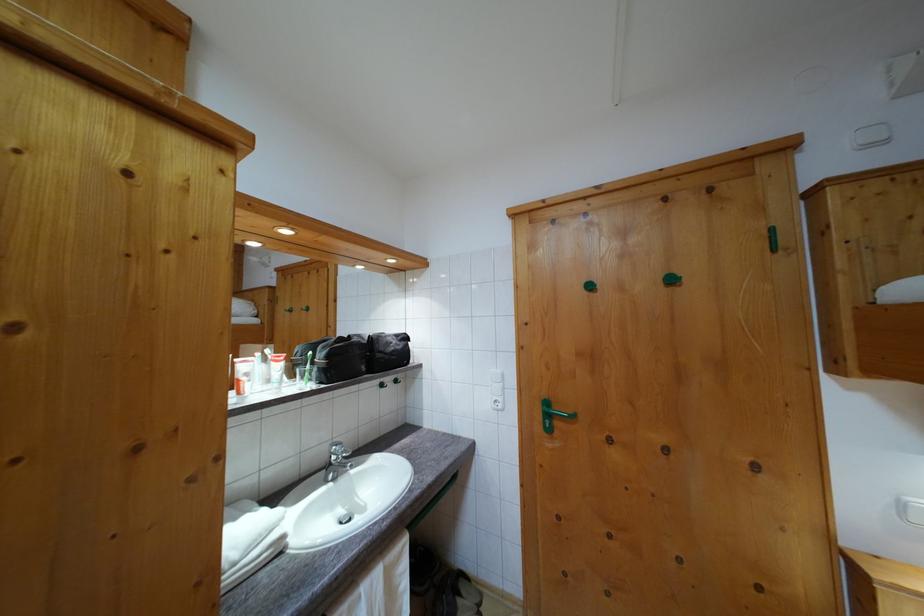
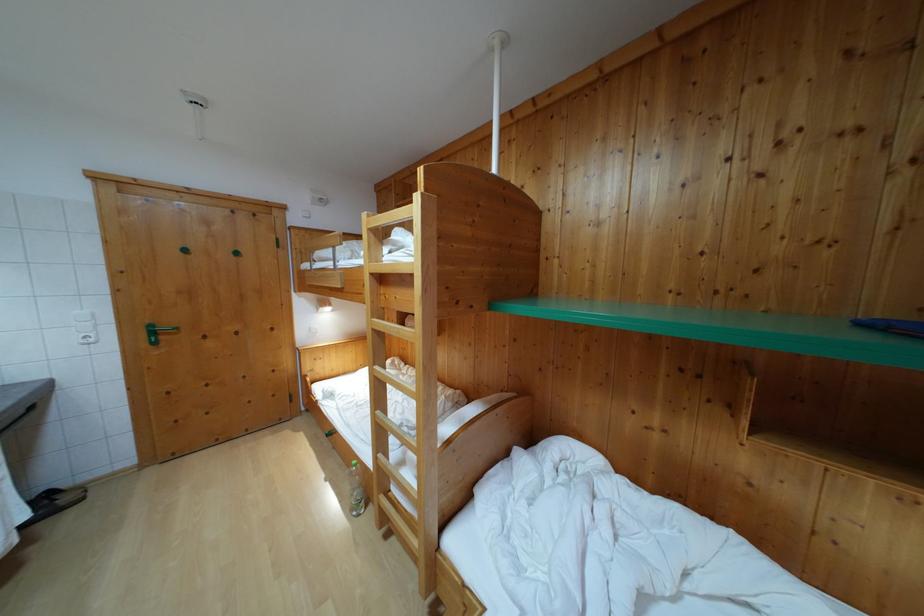
Locate, in the second image, the point that corresponds to (593,294) in the first image.

(189, 257)